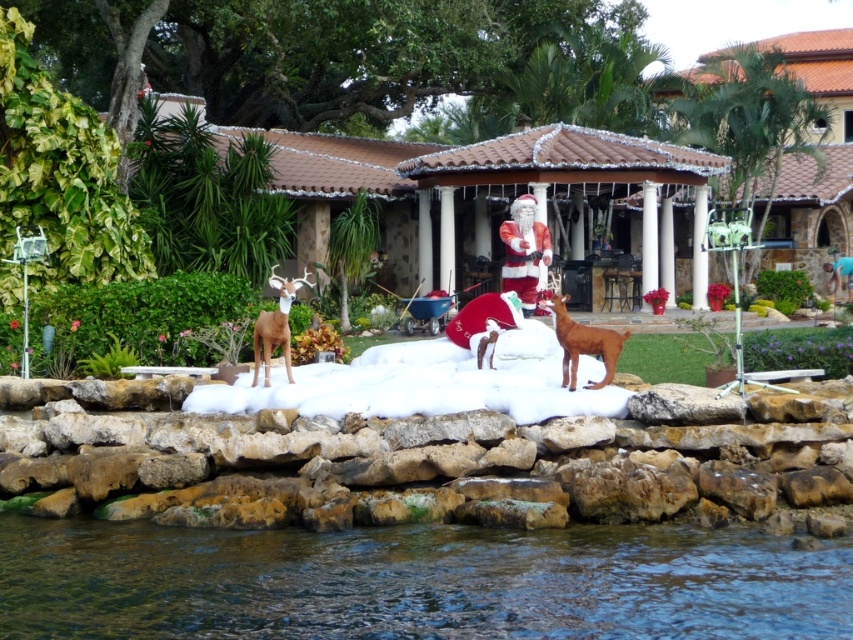
Is clear water at lower center above brown matte dog at center?

No, clear water at lower center is not above brown matte dog at center.

Describe the element at coordinates (416, 580) in the screenshot. I see `clear water at lower center` at that location.

Who is more distant from viewer, (318, 564) or (555, 307)?

The point (555, 307) is more distant.

This screenshot has height=640, width=853. In order to click on clear water at lower center in this screenshot , I will do `click(416, 580)`.

Based on the photo, is matte red santa at center positioned behind shiny brown deer at center?

Yes, it is behind shiny brown deer at center.

Is matte red santa at center above shiny brown deer at center?

Yes, matte red santa at center is above shiny brown deer at center.

Is point (543, 234) positioned after point (263, 342)?

Yes.

Image resolution: width=853 pixels, height=640 pixels. Find the location of `matte red santa at center`. matte red santa at center is located at coordinates (524, 252).

Is point (404, 362) positioned in front of point (502, 285)?

Yes, point (404, 362) is closer to viewer.

Does point (235, 396) come farther from viewer compared to point (524, 310)?

No, it is not.

Find the location of a particular element. white fluffy snow at center is located at coordinates (428, 381).